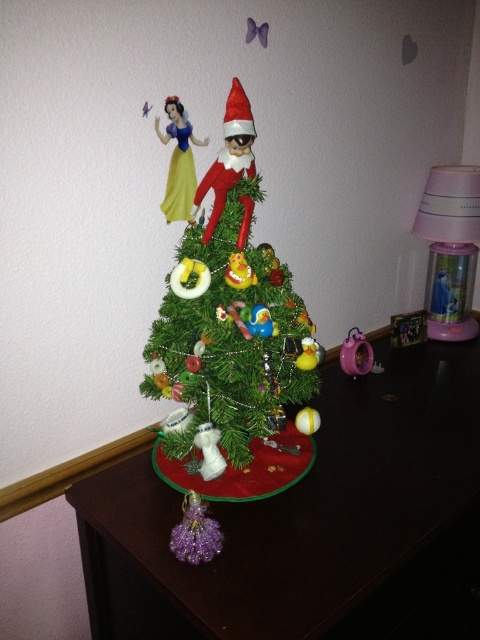
Question: Does green matte christmas tree at center lie behind yellow satin dress at upper left?

Choices:
 (A) no
 (B) yes

Answer: (A)

Question: Can you confirm if dark brown wooden table at center is bigger than yellow satin dress at upper left?

Choices:
 (A) no
 (B) yes

Answer: (B)

Question: Can you confirm if yellow satin dress at upper left is wider than pink plastic clock at lower right?

Choices:
 (A) no
 (B) yes

Answer: (A)

Question: Which of these objects is positioned farthest from the green matte christmas tree at center?

Choices:
 (A) yellow satin dress at upper left
 (B) pink plastic clock at lower right

Answer: (B)

Question: Which object appears farthest from the camera in this image?

Choices:
 (A) green matte christmas tree at center
 (B) dark brown wooden table at center
 (C) pink plastic clock at lower right
 (D) yellow satin dress at upper left

Answer: (C)

Question: Which object is closer to the camera taking this photo?

Choices:
 (A) yellow satin dress at upper left
 (B) dark brown wooden table at center
 (C) green matte christmas tree at center
 (D) pink plastic clock at lower right

Answer: (B)